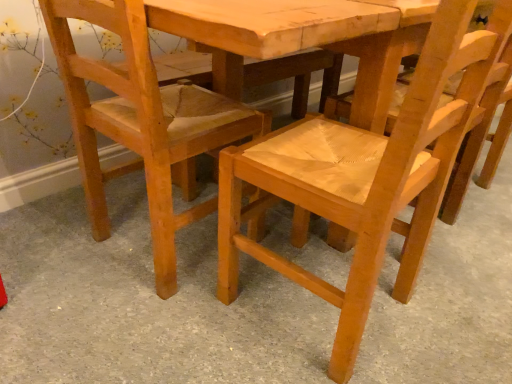
Question: Considering the relative positions of light brown wood chair at lower left, which ranks as the 1th chair in left-to-right order, and natural wood chair at center, which appears as the 2th chair when viewed from the left, in the image provided, is light brown wood chair at lower left, which ranks as the 1th chair in left-to-right order, to the right of natural wood chair at center, which appears as the 2th chair when viewed from the left, from the viewer's perspective?

Choices:
 (A) no
 (B) yes

Answer: (A)

Question: From the image's perspective, is light brown wood chair at lower left, which ranks as the 1th chair in left-to-right order, beneath natural wood chair at center, which appears as the 2th chair when viewed from the left?

Choices:
 (A) no
 (B) yes

Answer: (A)

Question: Does light brown wood chair at lower left, the second chair positioned from the right, have a lesser width compared to natural wood chair at center, the first chair from the right?

Choices:
 (A) no
 (B) yes

Answer: (A)

Question: Considering the relative positions of light brown wood chair at lower left, which ranks as the 1th chair in left-to-right order, and natural wood chair at center, which appears as the 2th chair when viewed from the left, in the image provided, is light brown wood chair at lower left, which ranks as the 1th chair in left-to-right order, in front of natural wood chair at center, which appears as the 2th chair when viewed from the left,?

Choices:
 (A) yes
 (B) no

Answer: (B)

Question: Is the depth of light brown wood chair at lower left, the second chair positioned from the right, greater than that of natural wood chair at center, which appears as the 2th chair when viewed from the left?

Choices:
 (A) no
 (B) yes

Answer: (B)

Question: From a real-world perspective, relative to light brown wood chair at lower left, which ranks as the 1th chair in left-to-right order, is natural wood chair at center, which appears as the 2th chair when viewed from the left, vertically above or below?

Choices:
 (A) above
 (B) below

Answer: (A)

Question: Looking at their shapes, would you say natural wood chair at center, which appears as the 2th chair when viewed from the left, is wider or thinner than light brown wood chair at lower left, which ranks as the 1th chair in left-to-right order?

Choices:
 (A) thin
 (B) wide

Answer: (A)

Question: Considering the positions of natural wood chair at center, the first chair from the right, and light brown wood chair at lower left, the second chair positioned from the right, in the image, is natural wood chair at center, the first chair from the right, taller or shorter than light brown wood chair at lower left, the second chair positioned from the right,?

Choices:
 (A) tall
 (B) short

Answer: (A)

Question: Choose the correct answer: Is natural wood chair at center, the first chair from the right, inside light brown wood chair at lower left, the second chair positioned from the right, or outside it?

Choices:
 (A) outside
 (B) inside

Answer: (A)

Question: Does point pyautogui.click(x=268, y=331) appear closer or farther from the camera than point pyautogui.click(x=285, y=185)?

Choices:
 (A) closer
 (B) farther

Answer: (B)

Question: Considering the positions of natural wood chair at center and natural wood chair at center, the first chair from the right, in the image, is natural wood chair at center wider or thinner than natural wood chair at center, the first chair from the right,?

Choices:
 (A) thin
 (B) wide

Answer: (B)

Question: Is natural wood chair at center bigger or smaller than natural wood chair at center, which appears as the 2th chair when viewed from the left?

Choices:
 (A) big
 (B) small

Answer: (A)

Question: Choose the correct answer: Is natural wood chair at center inside natural wood chair at center, the first chair from the right, or outside it?

Choices:
 (A) inside
 (B) outside

Answer: (B)

Question: Considering the positions of natural wood chair at center and light brown wood chair at lower left, the second chair positioned from the right, in the image, is natural wood chair at center wider or thinner than light brown wood chair at lower left, the second chair positioned from the right,?

Choices:
 (A) wide
 (B) thin

Answer: (A)

Question: Is natural wood chair at center spatially inside light brown wood chair at lower left, the second chair positioned from the right, or outside of it?

Choices:
 (A) inside
 (B) outside

Answer: (B)